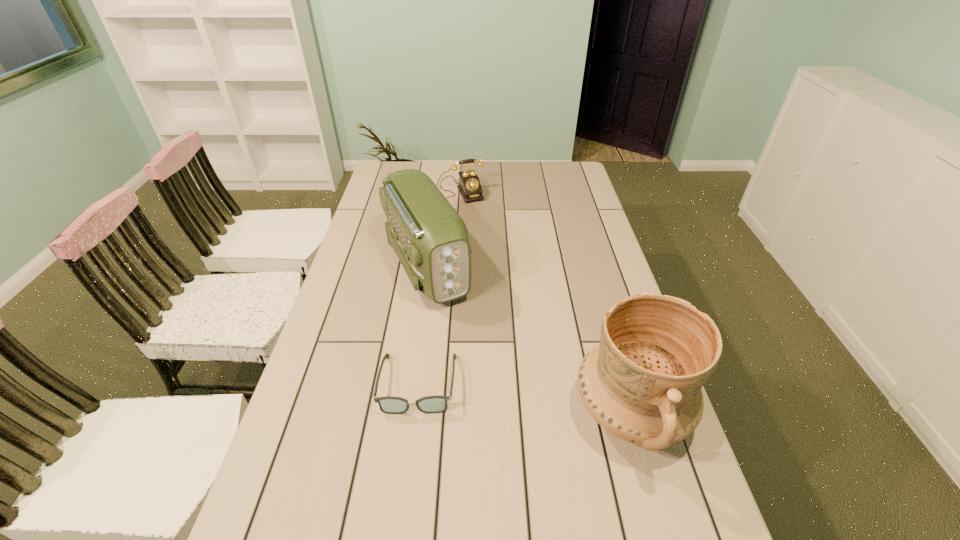
This screenshot has width=960, height=540. Find the location of `spectacles`. spectacles is located at coordinates (429, 404).

Find the location of a particular element. pottery is located at coordinates (642, 383).

The width and height of the screenshot is (960, 540). In order to click on the second farthest object in this screenshot , I will do 431,240.

Locate an element on the screen. telephone is located at coordinates (469, 186).

Find the location of a particular element. The width and height of the screenshot is (960, 540). the farthest object is located at coordinates (469, 186).

Locate an element on the screen. Image resolution: width=960 pixels, height=540 pixels. vacant space located on the face of the spectacles is located at coordinates (405, 489).

You are a GUI agent. You are given a task and a screenshot of the screen. Output one action in this format:
    pyautogui.click(x=<x>, y=<y>)
    Task: Click on the free space located on the front of the rightmost object
    This screenshot has height=540, width=960.
    Given the screenshot: What is the action you would take?
    pyautogui.click(x=659, y=511)

The height and width of the screenshot is (540, 960). Find the location of `blank space located 0.190m on the front-facing side of the second farthest object`. blank space located 0.190m on the front-facing side of the second farthest object is located at coordinates coord(468,355).

In order to click on vacant space positioned 0.140m on the front-facing side of the second farthest object in this screenshot , I will do `click(460, 342)`.

Where is `vacant region located on the front-facing side of the second farthest object`? vacant region located on the front-facing side of the second farthest object is located at coordinates (473, 366).